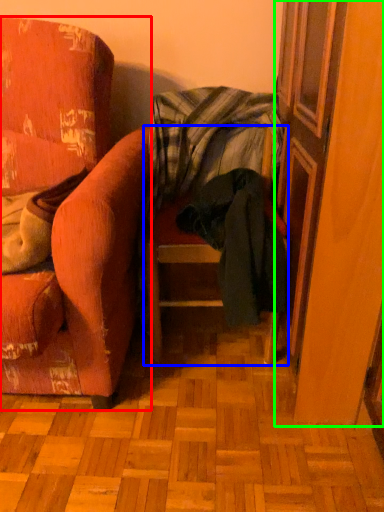
Question: Based on their relative distances, which object is farther from chair (highlighted by a red box)? Choose from chair (highlighted by a blue box) and screen door (highlighted by a green box).

Choices:
 (A) chair
 (B) screen door

Answer: (B)